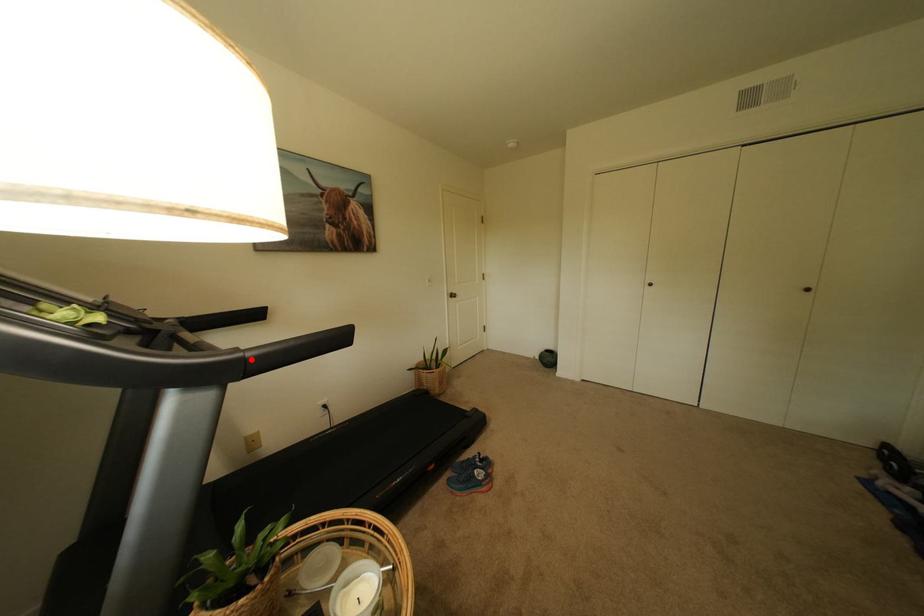
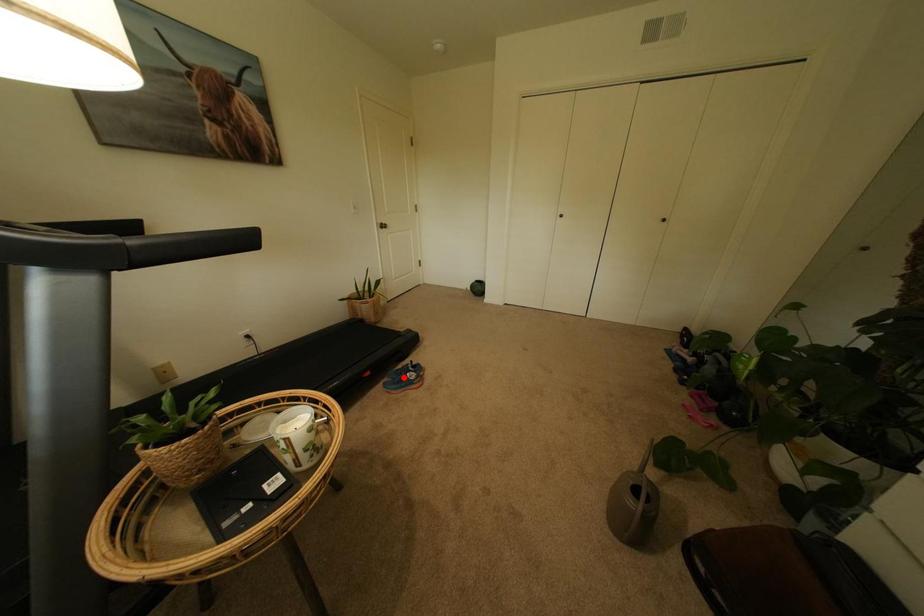
I am providing you with two images of the same scene from different viewpoints. A red point is marked on the first image and another point is marked on the second image. Does the point marked in image1 correspond to the same location as the one in image2?

No